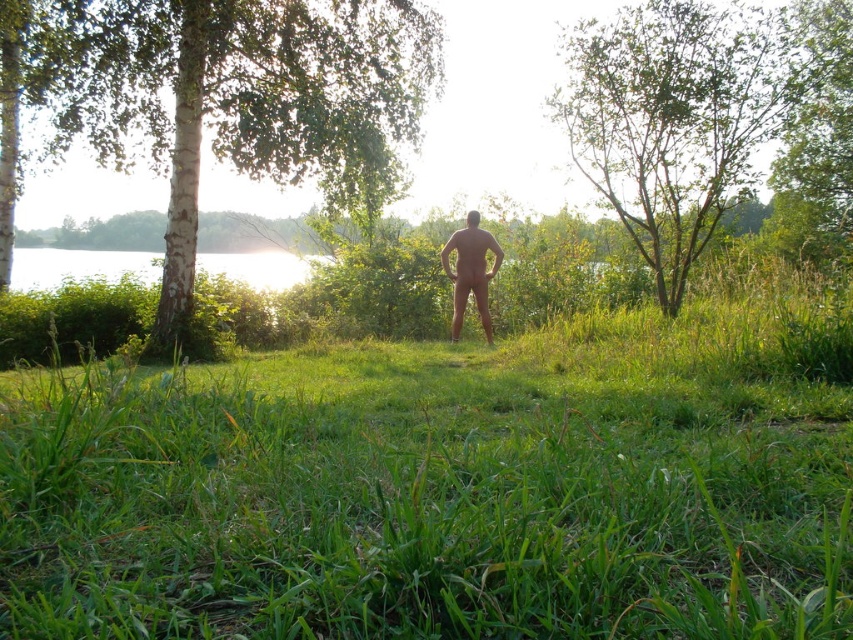
Question: Considering the real-world distances, which object is farthest from the green grassy at center?

Choices:
 (A) nude human at center
 (B) white bark tree at left
 (C) green leafy tree at upper center

Answer: (C)

Question: Is green grassy at center closer to the viewer compared to white bark tree at left?

Choices:
 (A) no
 (B) yes

Answer: (B)

Question: Is green leafy tree at upper center to the right of nude human at center from the viewer's perspective?

Choices:
 (A) yes
 (B) no

Answer: (A)

Question: Which of the following is the closest to the observer?

Choices:
 (A) (99, 467)
 (B) (488, 339)
 (C) (91, 44)
 (D) (660, 154)

Answer: (A)

Question: Which is farther from the nude human at center?

Choices:
 (A) white bark tree at left
 (B) green leafy tree at upper center
 (C) green grassy at center

Answer: (C)

Question: Can you confirm if green leafy tree at upper center is smaller than nude human at center?

Choices:
 (A) yes
 (B) no

Answer: (B)